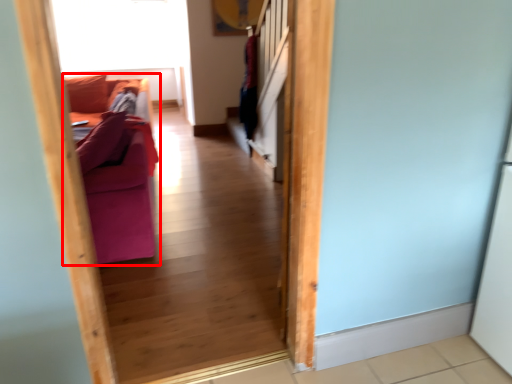
Question: From the image, what is the correct spatial relationship of furniture (annotated by the red box) in relation to window screen?

Choices:
 (A) right
 (B) left

Answer: (A)